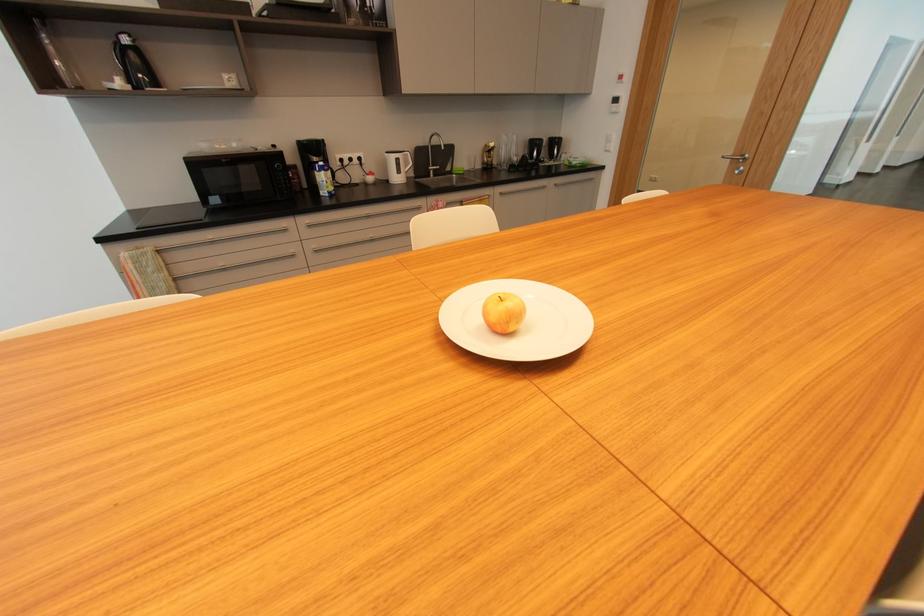
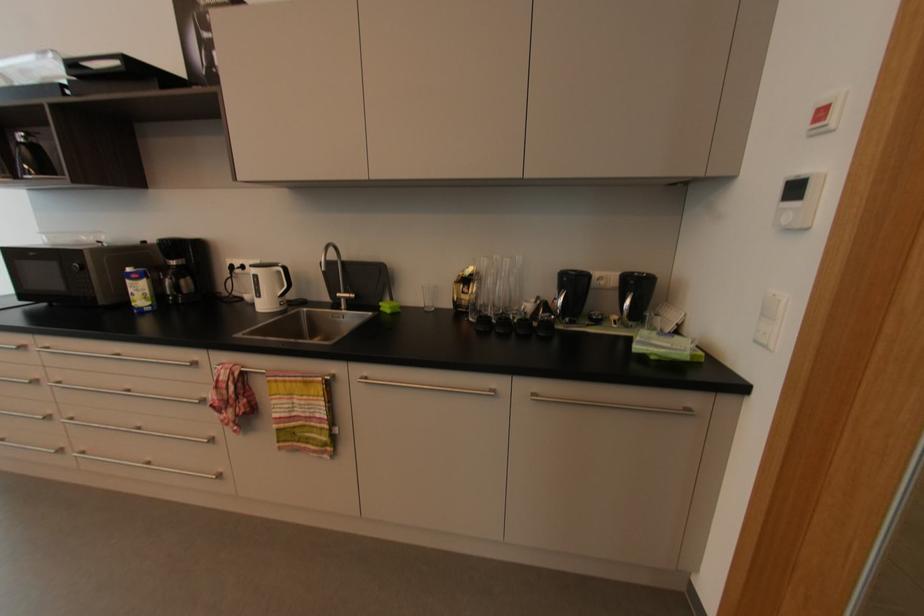
The point at (493,158) is marked in the first image. Where is the corresponding point in the second image?

(469, 294)